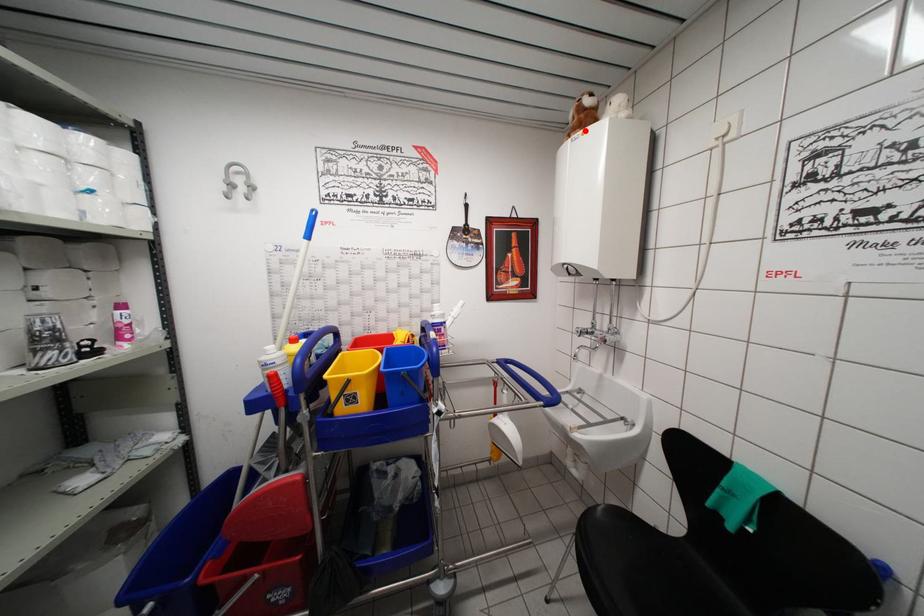
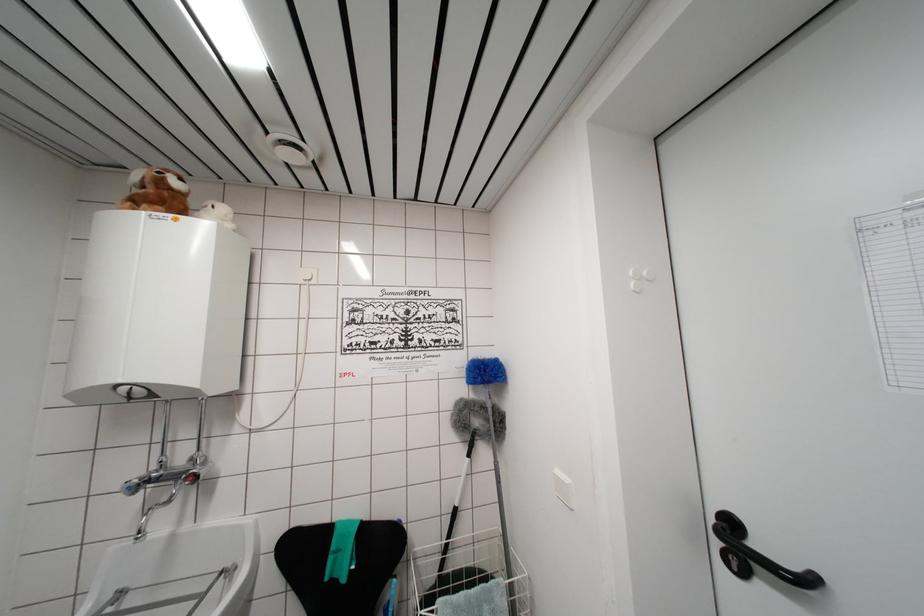
Where in the second image is the point corresponding to the highlighted location from the first image?

(168, 209)